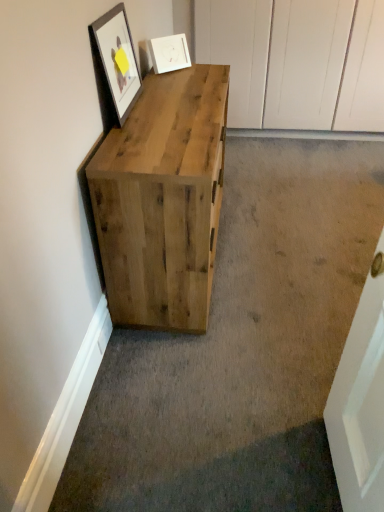
Question: Is matte black frame at upper left, which is counted as the first picture frame, starting from the front, oriented away from white matte picture frame at upper center, acting as the first picture frame starting from the back?

Choices:
 (A) no
 (B) yes

Answer: (A)

Question: Does matte black frame at upper left, which ranks as the 2th picture frame in right-to-left order, have a smaller size compared to white matte picture frame at upper center, the second picture frame when ordered from front to back?

Choices:
 (A) no
 (B) yes

Answer: (A)

Question: Considering the relative sizes of matte black frame at upper left, which is counted as the first picture frame, starting from the front, and white matte picture frame at upper center, arranged as the second picture frame when viewed from the left, in the image provided, is matte black frame at upper left, which is counted as the first picture frame, starting from the front, thinner than white matte picture frame at upper center, arranged as the second picture frame when viewed from the left,?

Choices:
 (A) no
 (B) yes

Answer: (B)

Question: Is matte black frame at upper left, which is counted as the first picture frame, starting from the front, at the right side of white matte picture frame at upper center, which ranks as the 1th picture frame in right-to-left order?

Choices:
 (A) yes
 (B) no

Answer: (B)

Question: From the image's perspective, is matte black frame at upper left, which ranks as the 2th picture frame in back-to-front order, beneath white matte picture frame at upper center, the second picture frame when ordered from front to back?

Choices:
 (A) no
 (B) yes

Answer: (B)

Question: Is matte black frame at upper left, which ranks as the 2th picture frame in back-to-front order, behind white matte picture frame at upper center, acting as the first picture frame starting from the back?

Choices:
 (A) yes
 (B) no

Answer: (B)

Question: Does white matte picture frame at upper center, acting as the first picture frame starting from the back, have a greater width compared to natural wood chest of drawers at left?

Choices:
 (A) no
 (B) yes

Answer: (A)

Question: Is white matte picture frame at upper center, arranged as the second picture frame when viewed from the left, taller than natural wood chest of drawers at left?

Choices:
 (A) yes
 (B) no

Answer: (B)

Question: Is natural wood chest of drawers at left inside white matte picture frame at upper center, arranged as the second picture frame when viewed from the left?

Choices:
 (A) no
 (B) yes

Answer: (A)

Question: From the image's perspective, is white matte picture frame at upper center, acting as the first picture frame starting from the back, above natural wood chest of drawers at left?

Choices:
 (A) no
 (B) yes

Answer: (B)

Question: Does white matte picture frame at upper center, which ranks as the 1th picture frame in right-to-left order, have a smaller size compared to natural wood chest of drawers at left?

Choices:
 (A) no
 (B) yes

Answer: (B)

Question: Is white matte picture frame at upper center, which ranks as the 1th picture frame in right-to-left order, facing towards natural wood chest of drawers at left?

Choices:
 (A) no
 (B) yes

Answer: (A)

Question: Is natural wood chest of drawers at left thinner than white matte picture frame at upper center, acting as the first picture frame starting from the back?

Choices:
 (A) no
 (B) yes

Answer: (A)